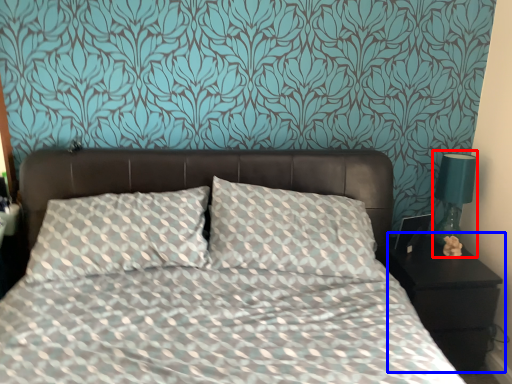
Question: Which of the following is the closest to the observer, bedside lamp (highlighted by a red box) or nightstand (highlighted by a blue box)?

Choices:
 (A) bedside lamp
 (B) nightstand

Answer: (B)